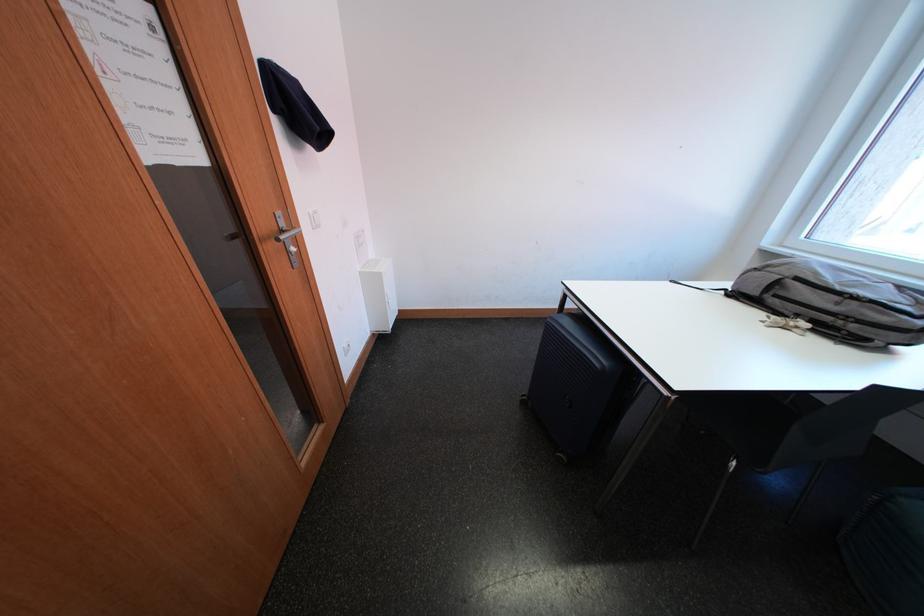
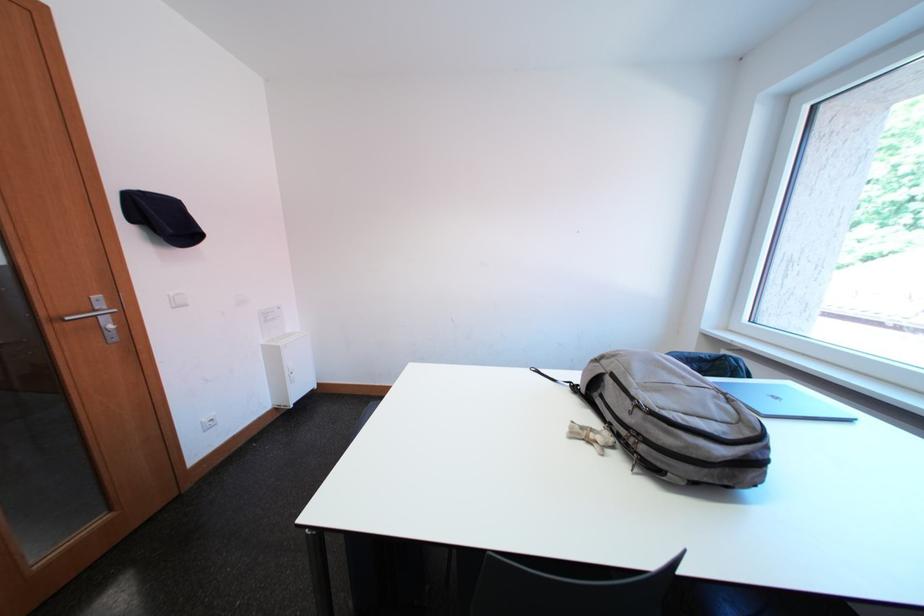
Question: What movement of the cameraman would produce the second image?

Choices:
 (A) Left
 (B) Right
 (C) Forward
 (D) Backward

Answer: (B)